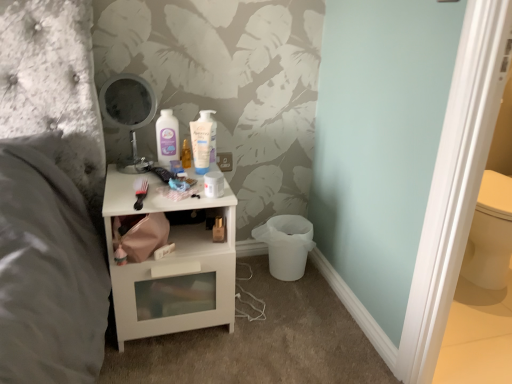
At what (x,y) coordinates should I click in order to perform the action: click on free point above white glossy nightstand at center (from a real-world perspective). Please return your answer as a coordinate pair (x, y). This screenshot has height=384, width=512. Looking at the image, I should click on (167, 172).